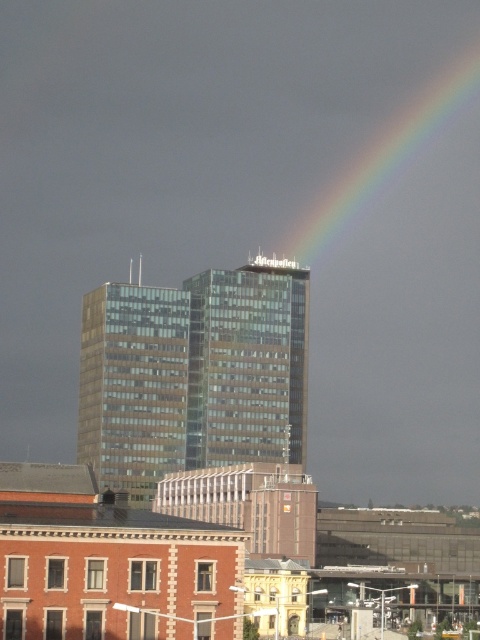
You are standing at the point indicated by the coordinates point (192, 374) in the cityscape. Looking around, you see the red brick building with white framed windows and the modern glass and steel high rise building. Which building is directly in front of you?

The transparent glass building at center is directly in front of you at point (192, 374).

You are an architect analyzing the cityscape. You need to determine which object occupies more visual space in the image. Based on the scene, which is larger in size between the transparent glass building at center and the rainbow at upper right?

The rainbow at upper right is larger in size compared to the transparent glass building at center.

In the scene shown: You are an architect analyzing the cityscape. You notice the transparent glass building at center and the rainbow at upper right. Which object is located higher in the scene?

The rainbow at upper right is higher because the transparent glass building at center is positioned under it.